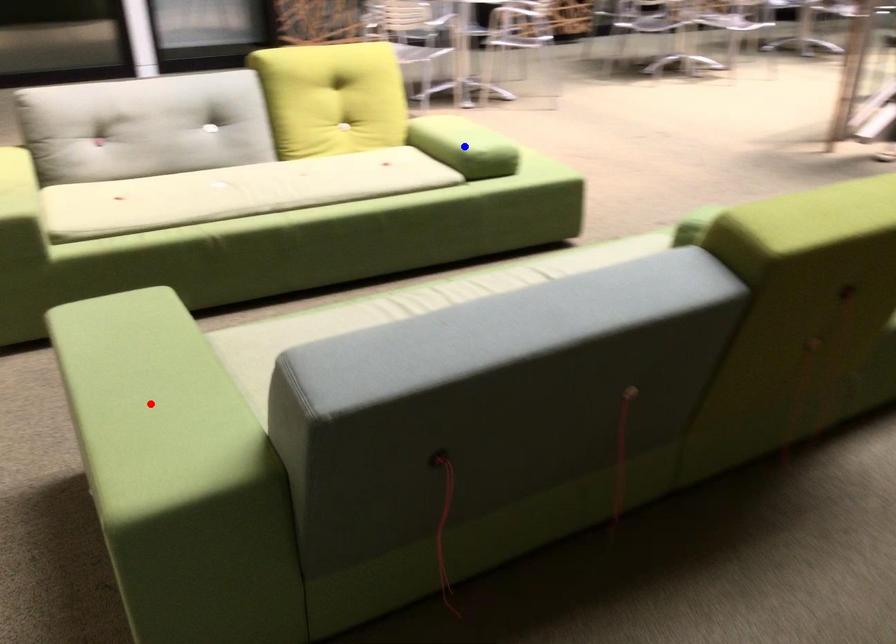
Question: Two points are marked on the image. Which point is closer to the camera?

Choices:
 (A) Blue point is closer.
 (B) Red point is closer.

Answer: (B)